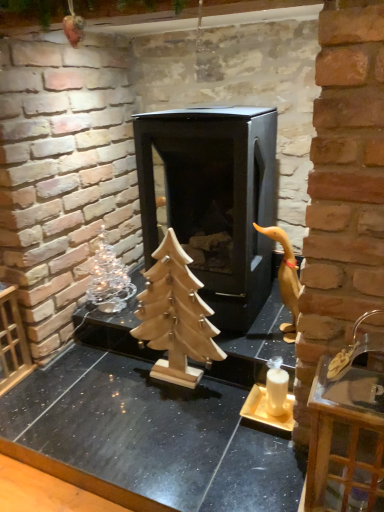
Question: Can you confirm if clear glass tray at right is thinner than black matte fireplace at center?

Choices:
 (A) yes
 (B) no

Answer: (A)

Question: From a real-world perspective, is clear glass tray at right on top of black matte fireplace at center?

Choices:
 (A) yes
 (B) no

Answer: (B)

Question: Is clear glass tray at right with black matte fireplace at center?

Choices:
 (A) yes
 (B) no

Answer: (B)

Question: Can you confirm if clear glass tray at right is taller than black matte fireplace at center?

Choices:
 (A) yes
 (B) no

Answer: (B)

Question: From the image's perspective, would you say clear glass tray at right is shown under black matte fireplace at center?

Choices:
 (A) no
 (B) yes

Answer: (B)

Question: From the image's perspective, is wooden tree at center above or below silver metallic christmas tree at left?

Choices:
 (A) below
 (B) above

Answer: (A)

Question: Is wooden tree at center situated inside silver metallic christmas tree at left or outside?

Choices:
 (A) outside
 (B) inside

Answer: (A)

Question: Is point (69, 358) positioned closer to the camera than point (112, 250)?

Choices:
 (A) closer
 (B) farther

Answer: (A)

Question: Considering the positions of wooden tree at center and silver metallic christmas tree at left in the image, is wooden tree at center taller or shorter than silver metallic christmas tree at left?

Choices:
 (A) tall
 (B) short

Answer: (B)

Question: Does point (91, 283) appear closer or farther from the camera than point (99, 440)?

Choices:
 (A) farther
 (B) closer

Answer: (A)

Question: Is silver metallic christmas tree at left spatially inside wooden tree at center, or outside of it?

Choices:
 (A) outside
 (B) inside

Answer: (A)

Question: From the image's perspective, is silver metallic christmas tree at left located above or below wooden tree at center?

Choices:
 (A) below
 (B) above

Answer: (B)

Question: In terms of width, does silver metallic christmas tree at left look wider or thinner when compared to wooden tree at center?

Choices:
 (A) thin
 (B) wide

Answer: (A)

Question: Considering the positions of wooden tree at center and white matte candle holder at lower right in the image, is wooden tree at center wider or thinner than white matte candle holder at lower right?

Choices:
 (A) thin
 (B) wide

Answer: (B)

Question: Is point (127, 446) positioned closer to the camera than point (279, 384)?

Choices:
 (A) closer
 (B) farther

Answer: (A)